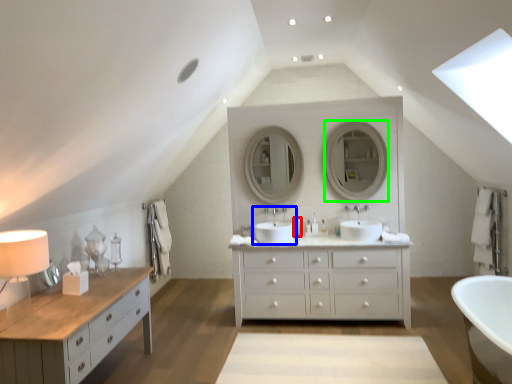
Question: Considering the real-world distances, which object is closest to toiletry (highlighted by a red box)? sink (highlighted by a blue box) or mirror (highlighted by a green box).

Choices:
 (A) sink
 (B) mirror

Answer: (A)